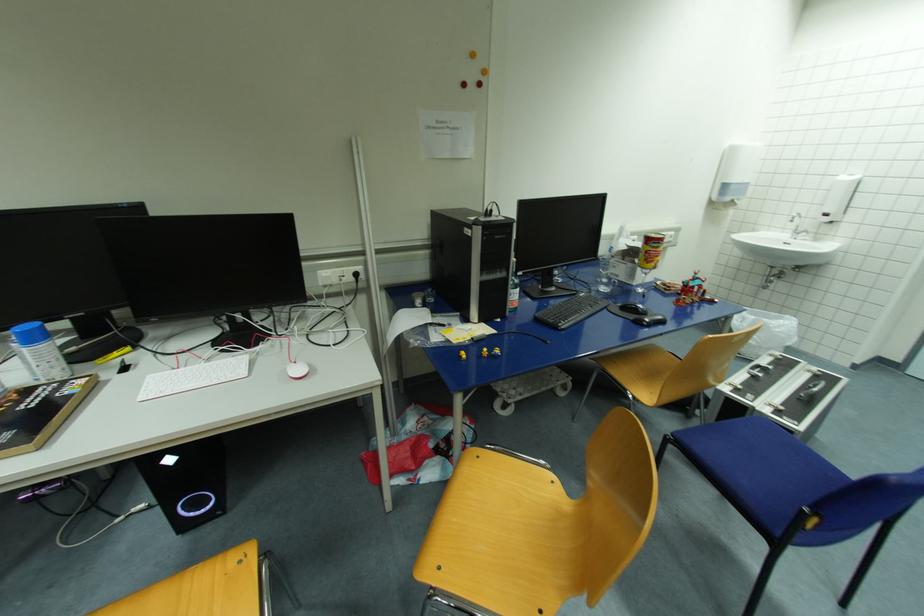
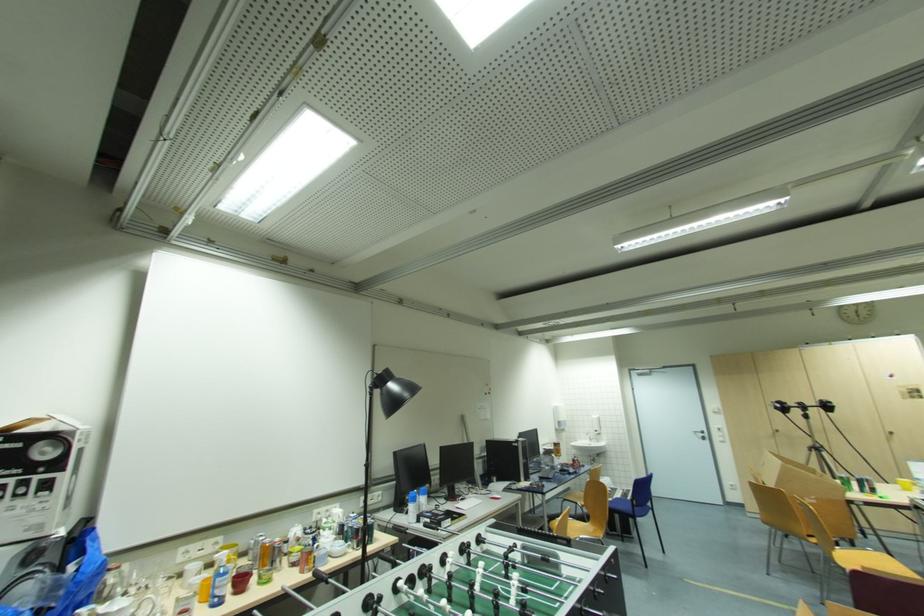
Find the pixel in the second image that matches point 830,220 in the first image.

(601, 434)